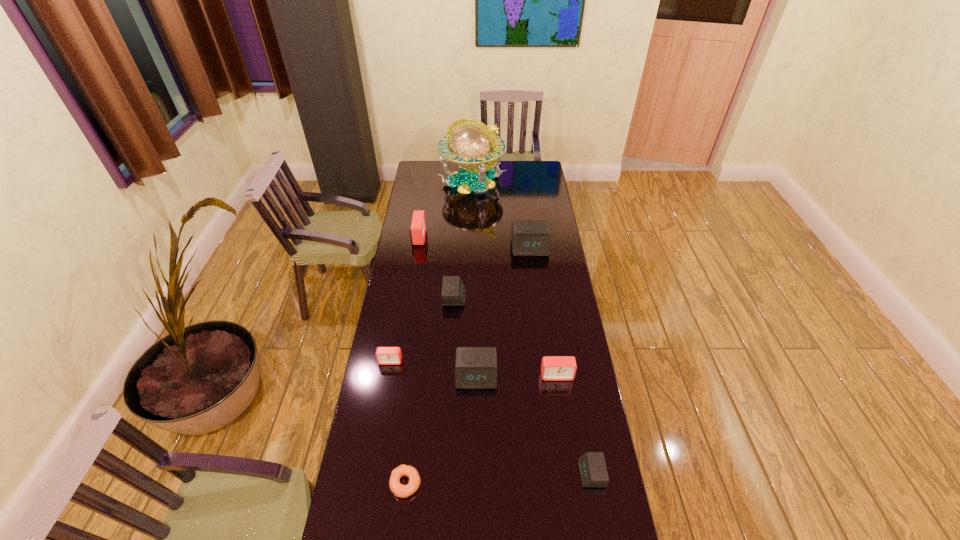
Locate an element on the screen. The width and height of the screenshot is (960, 540). free space located 0.290m on the front-facing side of the smallest red alarm clock is located at coordinates (377, 438).

Identify the location of free space located 0.310m on the front-facing side of the nearest black alarm clock. The width and height of the screenshot is (960, 540). (481, 474).

At what (x,y) coordinates should I click in order to perform the action: click on vacant space located on the front-facing side of the nearest black alarm clock. Please return your answer as a coordinate pair (x, y). Looking at the image, I should click on (564, 474).

Identify the location of free spot located on the front-facing side of the nearest black alarm clock. (453, 474).

This screenshot has height=540, width=960. What are the coordinates of `free point located 0.190m on the right of the shortest object` in the screenshot? It's located at (482, 483).

You are a GUI agent. You are given a task and a screenshot of the screen. Output one action in this format:
    pyautogui.click(x=<x>, y=<y>)
    Task: Click on the object at the far edge
    Image resolution: width=960 pixels, height=540 pixels.
    Given the screenshot: What is the action you would take?
    pyautogui.click(x=472, y=145)

At what (x,y) coordinates should I click in order to perform the action: click on globe that is at the left edge. Please return your answer as a coordinate pair (x, y). Looking at the image, I should click on (472, 145).

Identify the location of doughnut that is at the left edge. (400, 490).

Locate an element on the screen. object at the far left corner is located at coordinates (472, 145).

Identify the location of free space at the far edge of the desktop. This screenshot has width=960, height=540. (441, 179).